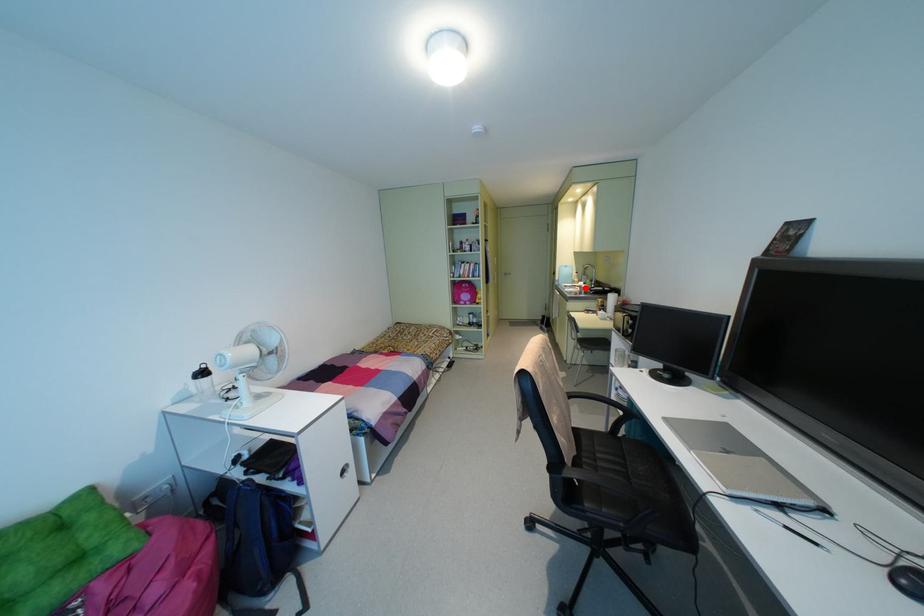
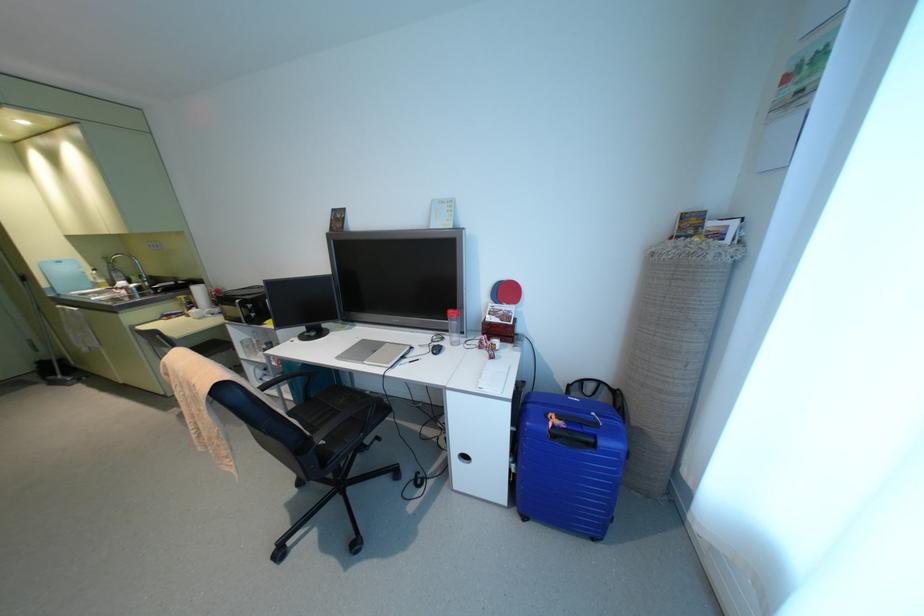
Question: I am providing you with two images of the same scene from different viewpoints. Image1 has a red point marked. In image2, the corresponding 3D location appears at what relative position? Reply with the corresponding letter.

Choices:
 (A) Closer
 (B) Farther

Answer: (B)